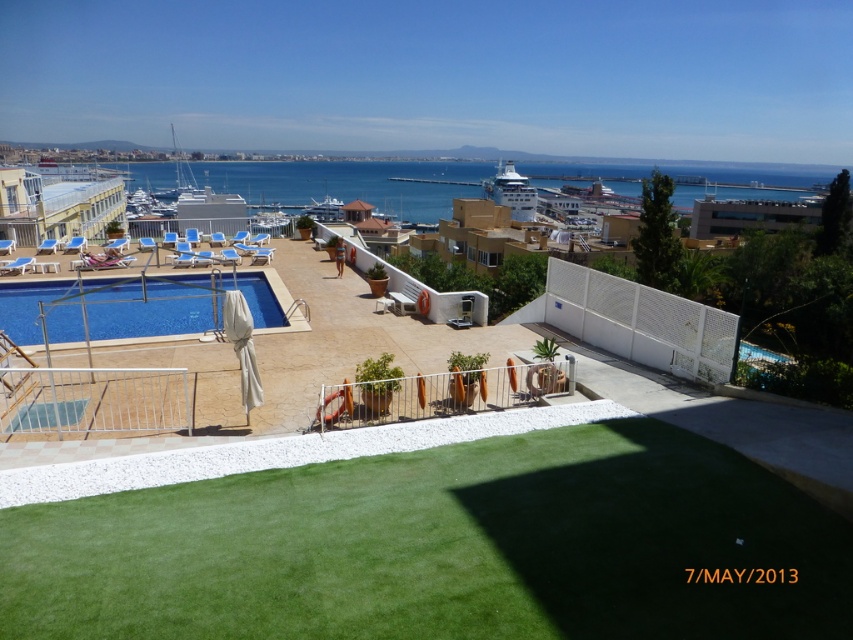
You are standing on the deck of the white glossy cruise ship at center and want to jump into the blue glossy pool at lower left. Can you safely jump from the ship to the pool?

The distance between the white glossy cruise ship at center and the blue glossy pool at lower left is 79.87 meters, which is too far for a safe jump. You should not attempt to jump from the ship to the pool.

You are planning to take a photo of the blue water at center and the white glossy cruise ship at center from the pool deck. Which object should you focus on first if you want to capture both in one frame without moving the camera?

You should focus on the blue water at center first because it is wider than the white glossy cruise ship at center, ensuring it fits within the frame.

You are a guest at the resort and want to take a photo of the white glossy cruise ship at center from the blue glossy pool at lower left. Which direction should you face to capture both in the same frame?

To capture both the blue glossy pool at lower left and the white glossy cruise ship at center in the same frame, you should face towards the right direction since the blue glossy pool at lower left is positioned to the left of the white glossy cruise ship at center.